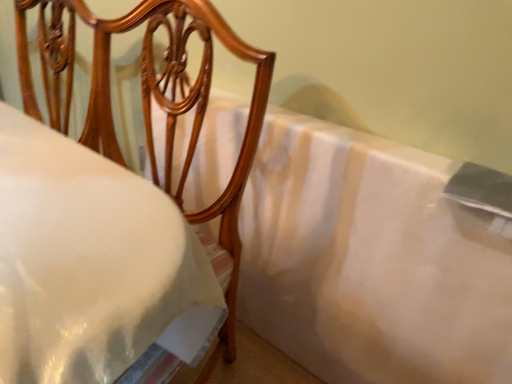
Question: Which is correct: matte wood chair at upper left is inside white satin bedsheet at center, or outside of it?

Choices:
 (A) inside
 (B) outside

Answer: (B)

Question: Considering the positions of matte wood chair at upper left and white satin bedsheet at center in the image, is matte wood chair at upper left bigger or smaller than white satin bedsheet at center?

Choices:
 (A) small
 (B) big

Answer: (B)

Question: Is matte wood chair at upper left to the left or to the right of white satin bedsheet at center in the image?

Choices:
 (A) left
 (B) right

Answer: (A)

Question: From a real-world perspective, relative to matte wood chair at upper left, is white satin bedsheet at center vertically above or below?

Choices:
 (A) above
 (B) below

Answer: (B)

Question: Is white satin bedsheet at center bigger or smaller than matte wood chair at upper left?

Choices:
 (A) big
 (B) small

Answer: (B)

Question: Does point (224, 147) appear closer or farther from the camera than point (70, 92)?

Choices:
 (A) farther
 (B) closer

Answer: (B)

Question: Choose the correct answer: Is white satin bedsheet at center inside matte wood chair at upper left or outside it?

Choices:
 (A) outside
 (B) inside

Answer: (A)